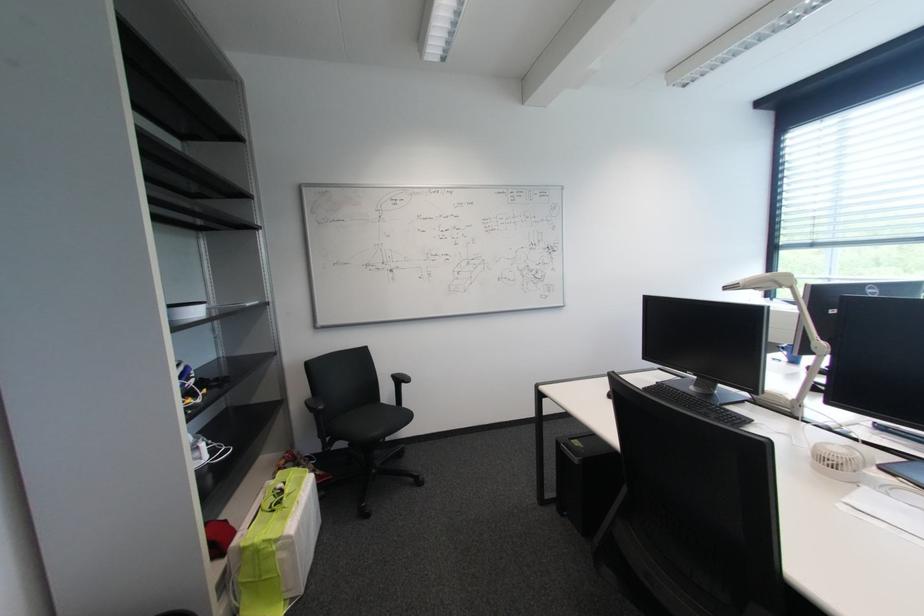
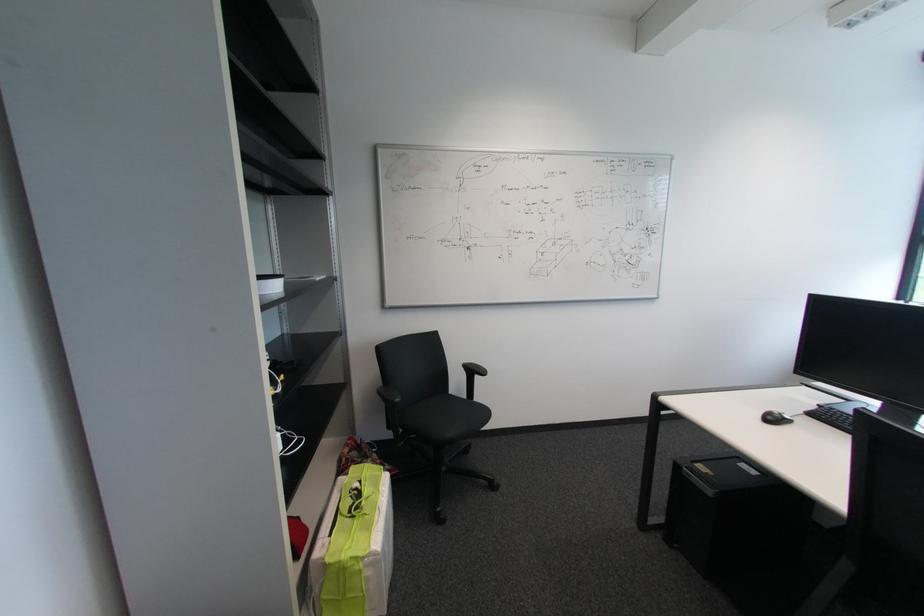
In the second image, find the point that corresponds to the point at 286,562 in the first image.

(372, 581)